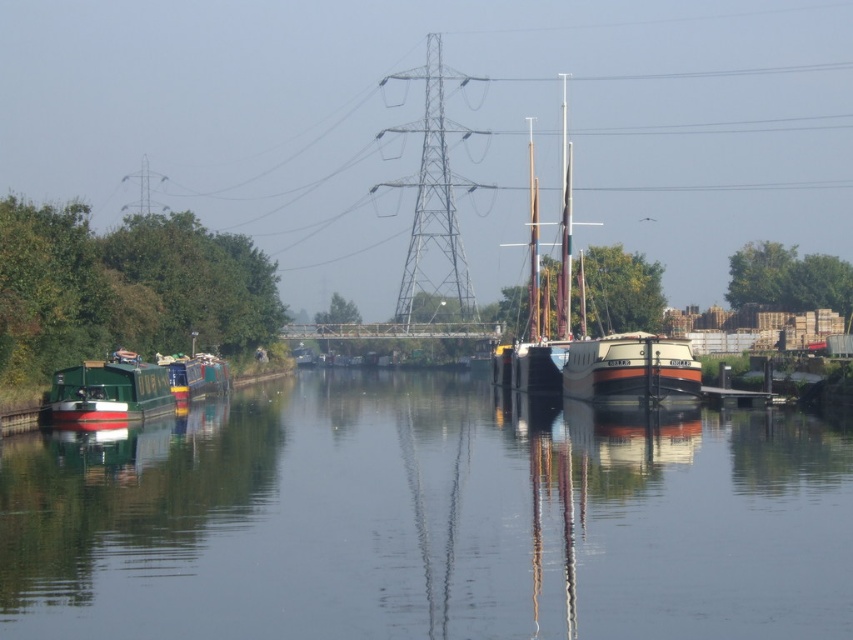
Does green matte canal boat at center have a lesser height compared to wooden sailboat at center?

Correct, green matte canal boat at center is not as tall as wooden sailboat at center.

Does green matte canal boat at center have a smaller size compared to wooden sailboat at center?

Yes.

At what (x,y) coordinates should I click in order to perform the action: click on green matte canal boat at center. Please return your answer as a coordinate pair (x, y). The image size is (853, 640). Looking at the image, I should click on (427, 518).

Who is higher up, green matte canal boat at center or green matte houseboat at left?

green matte houseboat at left is higher up.

Between green matte canal boat at center and green matte houseboat at left, which one appears on the right side from the viewer's perspective?

green matte canal boat at center

This screenshot has height=640, width=853. What do you see at coordinates (427, 518) in the screenshot?
I see `green matte canal boat at center` at bounding box center [427, 518].

The image size is (853, 640). I want to click on green matte canal boat at center, so click(427, 518).

Is point (628, 356) farther from camera compared to point (606, 385)?

No, it is not.

Measure the distance between point (570,170) and camera.

Point (570,170) is 219.62 meters away from camera.

Between point (503, 371) and point (691, 397), which one is positioned behind?

The point (503, 371) is behind.

At what (x,y) coordinates should I click in order to perform the action: click on wooden sailboat at center. Please return your answer as a coordinate pair (x, y). The height and width of the screenshot is (640, 853). Looking at the image, I should click on click(584, 330).